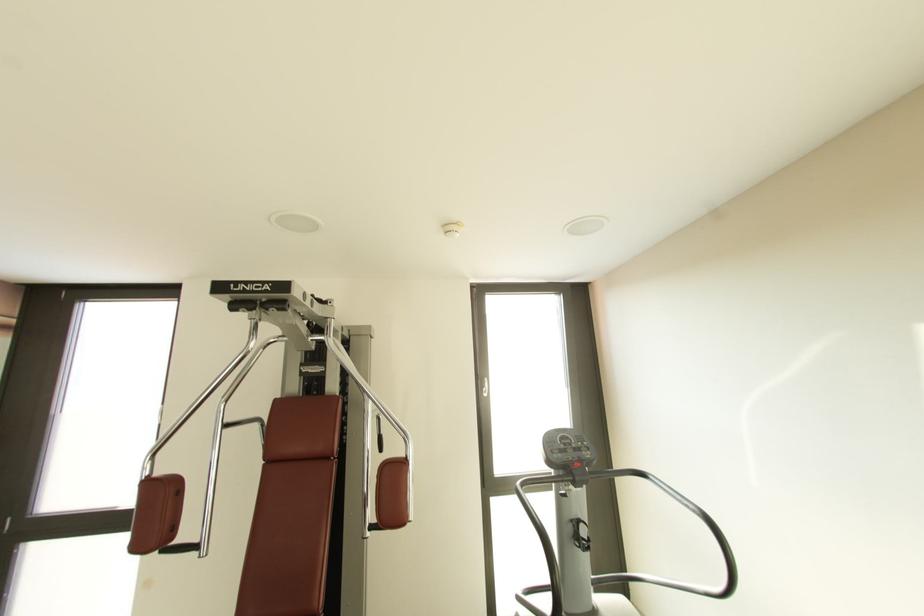
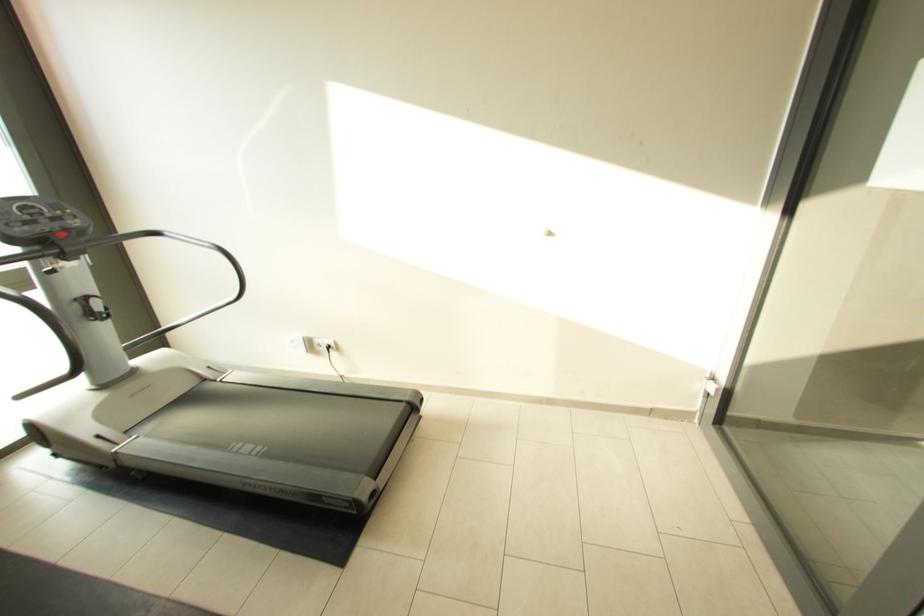
In the second image, find the point that corresponds to pixel 698 513 in the first image.

(214, 249)